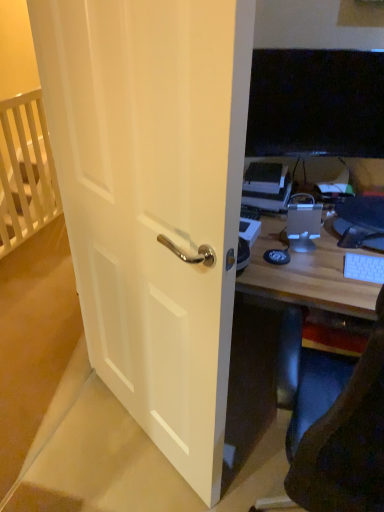
The height and width of the screenshot is (512, 384). I want to click on free space in front of white wooden crib at upper left, so click(29, 262).